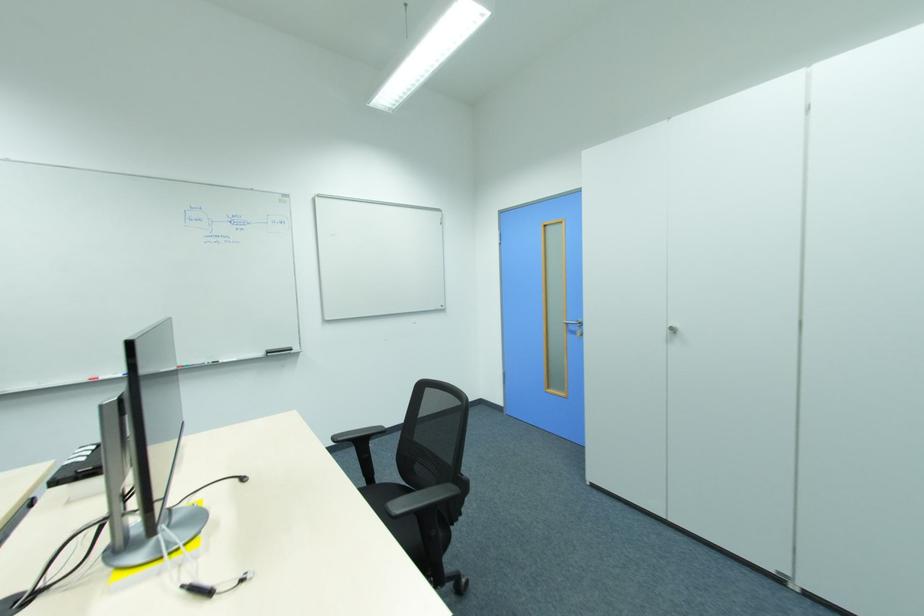
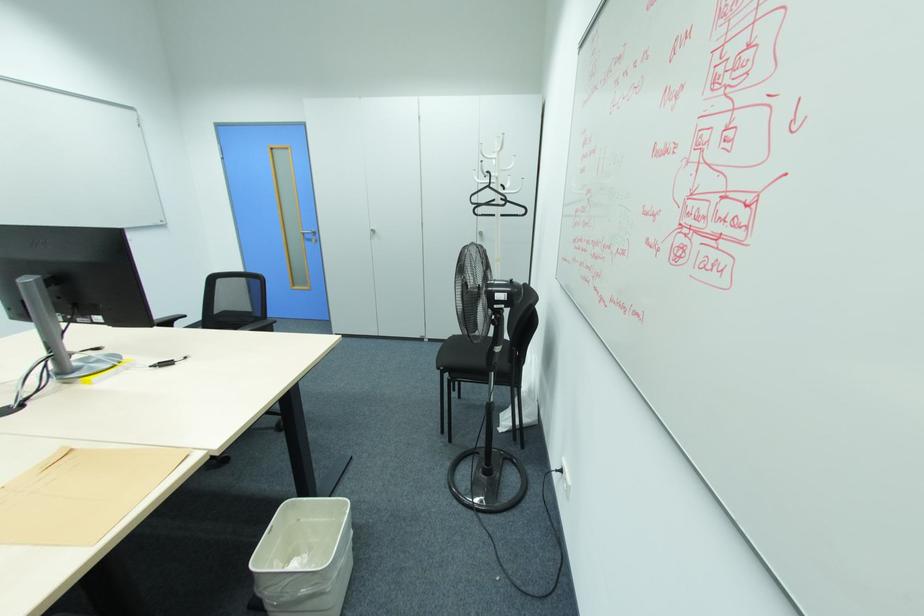
Where in the second image is the point corresponding to pixel 675 330 from the first image?

(373, 231)